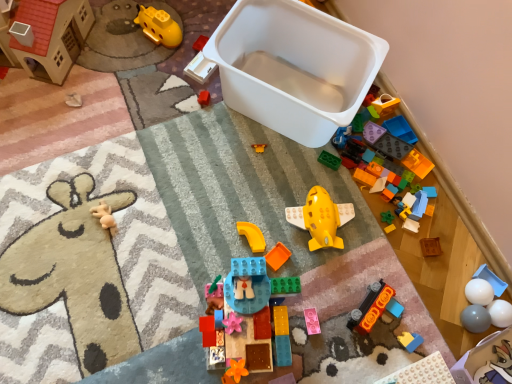
The width and height of the screenshot is (512, 384). I want to click on free space that is in between matte plastic toy at lower right, which is counted as the 12th toy, starting from the left, and cardboard house at upper left, the 1th toy positioned from the left, so click(169, 155).